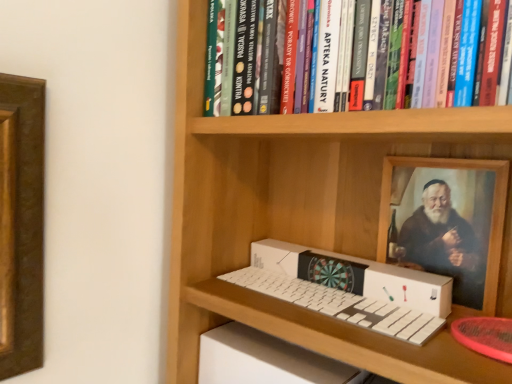
Locate an element on the screen. blank space situated above white cardboard box at center (from a real-world perspective) is located at coordinates (351, 262).